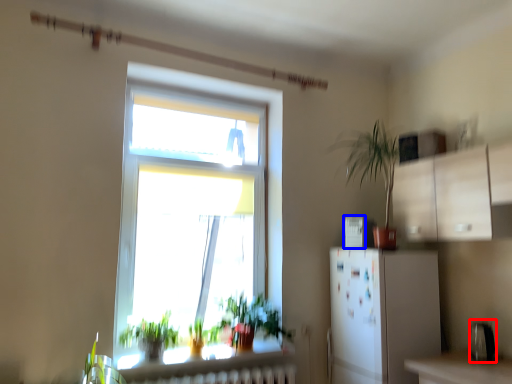
Question: Which object is further to the camera taking this photo, appliance (highlighted by a red box) or appliance (highlighted by a blue box)?

Choices:
 (A) appliance
 (B) appliance

Answer: (B)